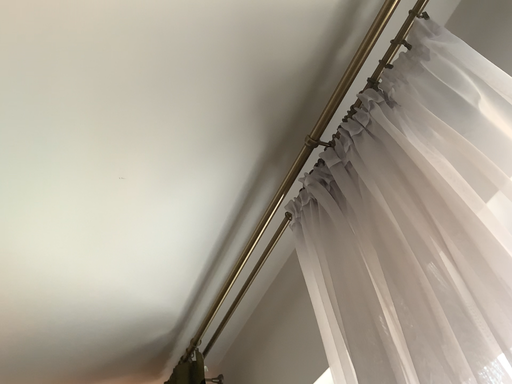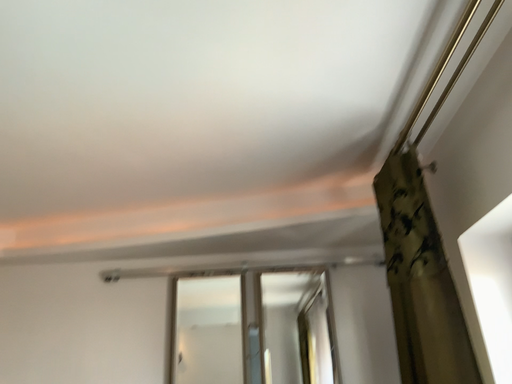
Question: How did the camera likely rotate when shooting the video?

Choices:
 (A) rotated right
 (B) rotated left

Answer: (B)